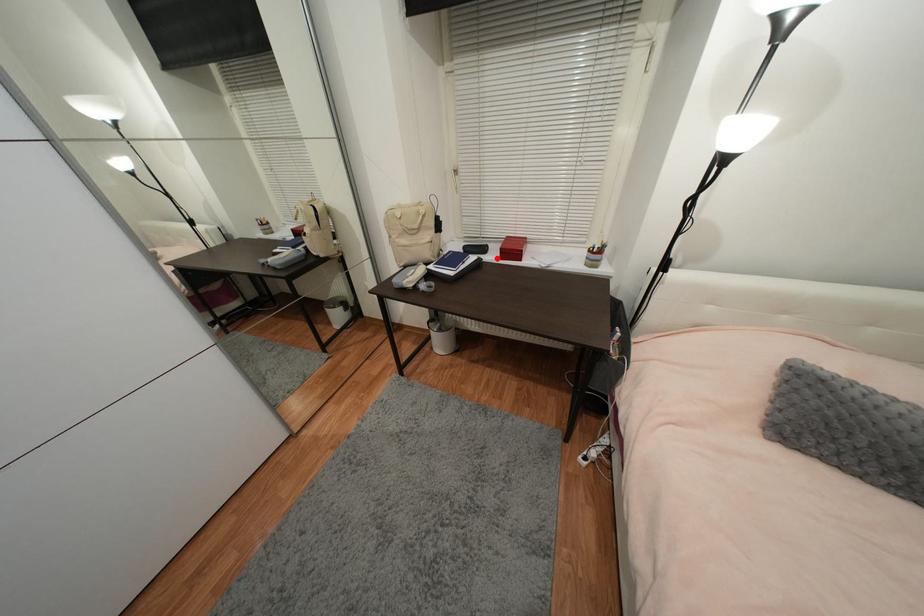
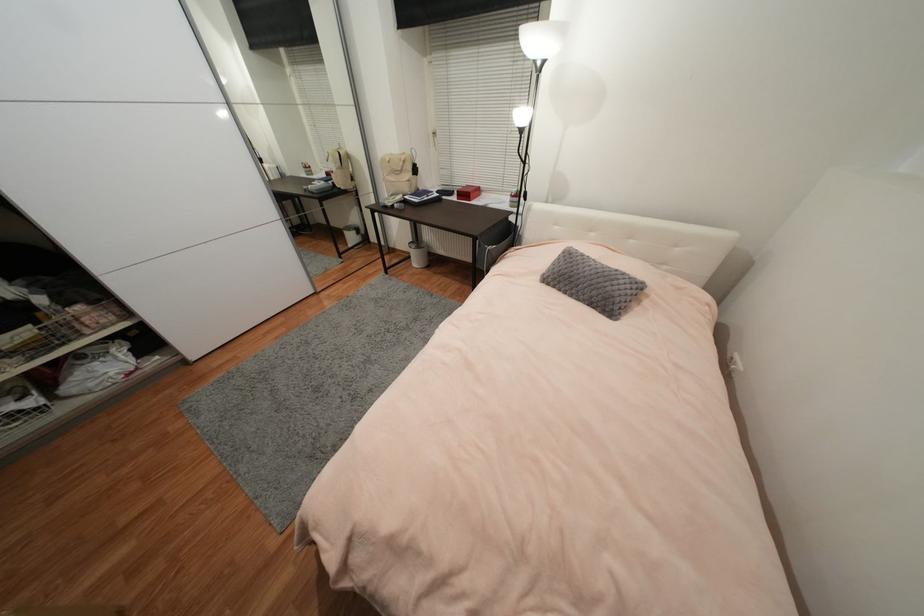
In the second image, find the point that corresponds to the highlighted location in the first image.

(458, 199)